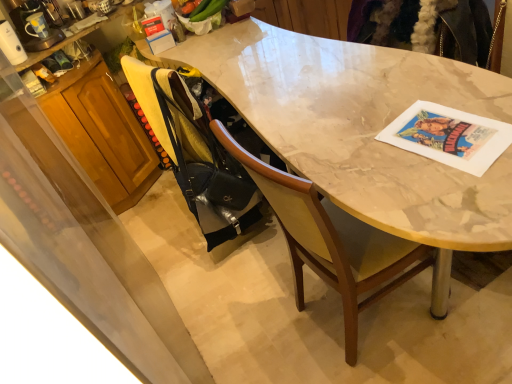
Question: Should I look upward or downward to see marble table at center?

Choices:
 (A) down
 (B) up

Answer: (B)

Question: Considering the relative positions of black matte handbag at lower left and marble table at center in the image provided, is black matte handbag at lower left to the right of marble table at center from the viewer's perspective?

Choices:
 (A) no
 (B) yes

Answer: (A)

Question: Can you confirm if black matte handbag at lower left is wider than marble table at center?

Choices:
 (A) no
 (B) yes

Answer: (A)

Question: Is marble table at center a part of black matte handbag at lower left?

Choices:
 (A) yes
 (B) no

Answer: (B)

Question: Can you see black matte handbag at lower left touching marble table at center?

Choices:
 (A) no
 (B) yes

Answer: (A)

Question: Is black matte handbag at lower left bigger than marble table at center?

Choices:
 (A) yes
 (B) no

Answer: (B)

Question: Is black matte handbag at lower left positioned behind marble table at center?

Choices:
 (A) yes
 (B) no

Answer: (A)

Question: Is marble table at center next to wooden cabinet at left and touching it?

Choices:
 (A) yes
 (B) no

Answer: (B)

Question: Considering the relative sizes of marble table at center and wooden cabinet at left in the image provided, is marble table at center smaller than wooden cabinet at left?

Choices:
 (A) yes
 (B) no

Answer: (B)

Question: Are marble table at center and wooden cabinet at left far apart?

Choices:
 (A) no
 (B) yes

Answer: (A)

Question: Can you confirm if marble table at center is bigger than wooden cabinet at left?

Choices:
 (A) no
 (B) yes

Answer: (B)

Question: From the image's perspective, is marble table at center below wooden cabinet at left?

Choices:
 (A) yes
 (B) no

Answer: (A)

Question: From a real-world perspective, is marble table at center on top of wooden cabinet at left?

Choices:
 (A) yes
 (B) no

Answer: (A)

Question: Can you confirm if wooden cabinet at left is smaller than marble table at center?

Choices:
 (A) no
 (B) yes

Answer: (B)